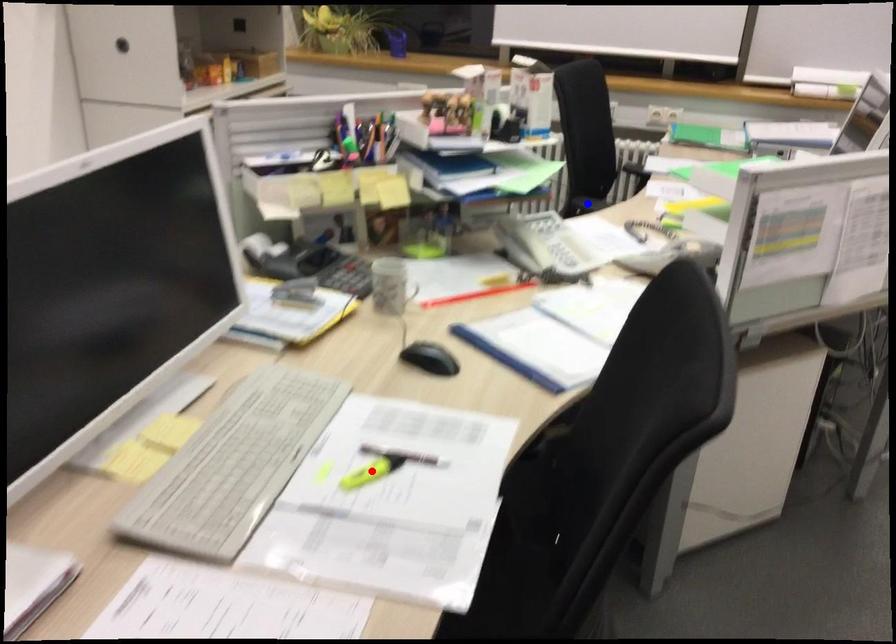
Question: Two points are marked on the image. Which point is closer to the camera?

Choices:
 (A) Blue point is closer.
 (B) Red point is closer.

Answer: (B)